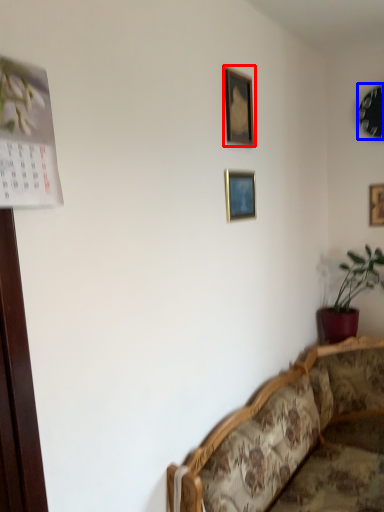
Question: Which point is further to the camera, picture frame (highlighted by a red box) or picture frame (highlighted by a blue box)?

Choices:
 (A) picture frame
 (B) picture frame

Answer: (B)